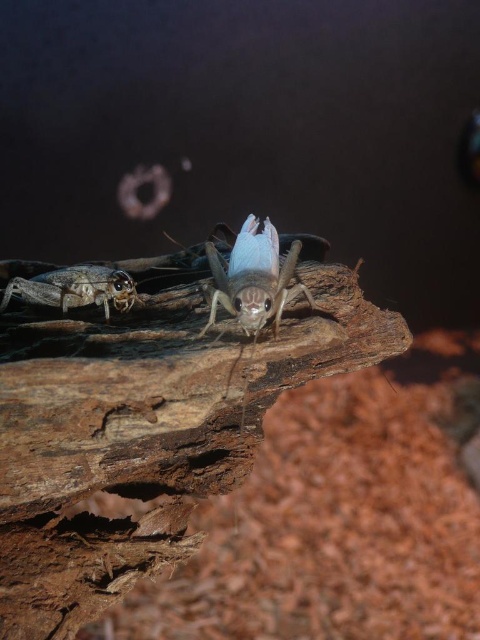
You are an entomologist examining a piece of wood with two crickets. You notice the brown rough wood at center and the translucent brown cricket at lower left. Which object is positioned lower in the image?

The brown rough wood at center is positioned below the translucent brown cricket at lower left, so the brown rough wood at center is lower in the image.

You are a photographer trying to capture a clear image of the translucent blue wings at center without the brown rough wood at center blocking it. Is this possible given their current positions?

The brown rough wood at center is in front of the translucent blue wings at center, so it is blocking the view. To capture the wings clearly, you would need to adjust the camera angle or move the wood to avoid obstruction.

Based on the photo, you are a photographer trying to capture a closeup of the translucent brown cricket at lower left. Based on the scene, will the brown rough wood at center be in focus in your photo?

The brown rough wood at center is closer to the viewer than the translucent brown cricket at lower left. Since the cricket is the focus point, the wood will likely be out of focus in the photo.